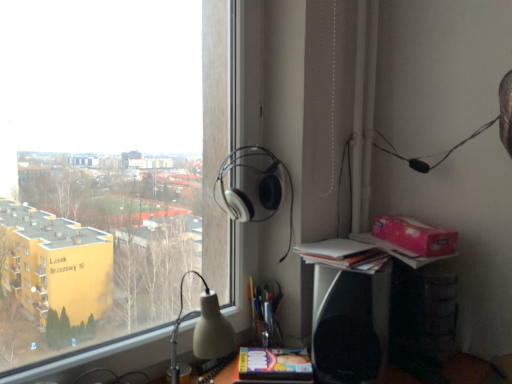
This screenshot has width=512, height=384. Identify the location of transparent glass window at upper left. (111, 170).

Find the location of `pink cardboard box at upper right`. pink cardboard box at upper right is located at coordinates (415, 235).

Considering the sizes of objects white paper stack at right and matte yellow paperback book at lower center in the image provided, who is thinner, white paper stack at right or matte yellow paperback book at lower center?

matte yellow paperback book at lower center.

Between white paper stack at right and matte yellow paperback book at lower center, which one has less height?

matte yellow paperback book at lower center is shorter.

Based on the photo, does white paper stack at right come in front of matte yellow paperback book at lower center?

Yes, the depth of white paper stack at right is less than that of matte yellow paperback book at lower center.

From the image's perspective, is white paper stack at right located beneath matte yellow paperback book at lower center?

Incorrect, from the image's perspective, white paper stack at right is higher than matte yellow paperback book at lower center.

Is matte yellow paperback book at lower center aimed at transparent glass window at upper left?

No.

Image resolution: width=512 pixels, height=384 pixels. Find the location of `paperback book on the right of transparent glass window at upper left`. paperback book on the right of transparent glass window at upper left is located at coordinates (274, 364).

From a real-world perspective, who is located higher, matte yellow paperback book at lower center or transparent glass window at upper left?

In real-world perspective, transparent glass window at upper left is above.

Considering the relative positions of matte yellow paperback book at lower center and transparent glass window at upper left in the image provided, is matte yellow paperback book at lower center to the left or to the right of transparent glass window at upper left?

matte yellow paperback book at lower center is to the right of transparent glass window at upper left.

Is point (355, 374) behind point (337, 249)?

No, (355, 374) is in front of (337, 249).

From the image's perspective, is black plastic speaker at lower right beneath white paper stack at right?

Indeed, from the image's perspective, black plastic speaker at lower right is shown beneath white paper stack at right.

Who is smaller, black plastic speaker at lower right or white paper stack at right?

white paper stack at right is smaller.

Consider the image. Considering the relative positions of black plastic speaker at lower right and white paper stack at right in the image provided, is black plastic speaker at lower right to the left or to the right of white paper stack at right?

black plastic speaker at lower right is positioned on white paper stack at right's right side.

From a real-world perspective, is white paper stack at right above or below pink cardboard box at upper right?

white paper stack at right is below pink cardboard box at upper right.

From the image's perspective, relative to pink cardboard box at upper right, is white paper stack at right above or below?

white paper stack at right is below pink cardboard box at upper right.

Who is shorter, white paper stack at right or pink cardboard box at upper right?

With less height is white paper stack at right.

Does transparent glass window at upper left have a lesser height compared to white paper stack at right?

No, transparent glass window at upper left is not shorter than white paper stack at right.

Does transparent glass window at upper left appear on the right side of white paper stack at right?

No, transparent glass window at upper left is not to the right of white paper stack at right.

The width and height of the screenshot is (512, 384). Find the location of `book beneath the transparent glass window at upper left (from a real-world perspective)`. book beneath the transparent glass window at upper left (from a real-world perspective) is located at coordinates (343, 254).

From the image's perspective, is transparent glass window at upper left on white paper stack at right?

Indeed, from the image's perspective, transparent glass window at upper left is shown above white paper stack at right.

From the image's perspective, which one is positioned higher, white matte headphones at upper center or matte yellow paperback book at lower center?

From the image's view, white matte headphones at upper center is above.

Is white matte headphones at upper center next to matte yellow paperback book at lower center and touching it?

No, white matte headphones at upper center is not beside matte yellow paperback book at lower center.

Is white matte headphones at upper center taller than matte yellow paperback book at lower center?

Indeed, white matte headphones at upper center has a greater height compared to matte yellow paperback book at lower center.

Is white matte headphones at upper center at the left side of matte yellow paperback book at lower center?

Correct, you'll find white matte headphones at upper center to the left of matte yellow paperback book at lower center.

From the image's perspective, between pink cardboard box at upper right and transparent glass window at upper left, who is located below?

pink cardboard box at upper right, from the image's perspective.

In order to click on cardboard box below the transparent glass window at upper left (from the image's perspective) in this screenshot , I will do `click(415, 235)`.

Considering the positions of objects pink cardboard box at upper right and transparent glass window at upper left in the image provided, who is behind, pink cardboard box at upper right or transparent glass window at upper left?

pink cardboard box at upper right is further from the camera.

Does pink cardboard box at upper right have a smaller size compared to transparent glass window at upper left?

Yes, pink cardboard box at upper right is smaller than transparent glass window at upper left.

At what (x,y) coordinates should I click in order to perform the action: click on paperback book on the left side of white paper stack at right. Please return your answer as a coordinate pair (x, y). The image size is (512, 384). Looking at the image, I should click on (274, 364).

Where is `window above the matte yellow paperback book at lower center (from a real-world perspective)`? The height and width of the screenshot is (384, 512). window above the matte yellow paperback book at lower center (from a real-world perspective) is located at coordinates (111, 170).

In the scene shown: Based on their spatial positions, is white matte headphones at upper center or matte yellow paperback book at lower center further from pink cardboard box at upper right?

matte yellow paperback book at lower center.

Considering their positions, is white paper stack at right positioned closer to black plastic speaker at lower right than white matte headphones at upper center?

Based on the image, white paper stack at right appears to be nearer to black plastic speaker at lower right.

From the image, which object appears to be nearer to transparent glass window at upper left, pink cardboard box at upper right or black plastic speaker at lower right?

black plastic speaker at lower right is closer to transparent glass window at upper left.

Based on their spatial positions, is matte yellow paperback book at lower center or white matte headphones at upper center further from black plastic speaker at lower right?

Based on the image, white matte headphones at upper center appears to be further to black plastic speaker at lower right.

Consider the image. Based on their spatial positions, is pink cardboard box at upper right or white matte headphones at upper center closer to matte yellow paperback book at lower center?

Among the two, white matte headphones at upper center is located nearer to matte yellow paperback book at lower center.

Based on their spatial positions, is matte yellow paperback book at lower center or white paper stack at right closer to white matte headphones at upper center?

white paper stack at right is positioned closer to the anchor white matte headphones at upper center.

Estimate the real-world distances between objects in this image. Which object is closer to black plastic speaker at lower right, white matte headphones at upper center or transparent glass window at upper left?

white matte headphones at upper center is positioned closer to the anchor black plastic speaker at lower right.

Looking at the image, which one is located closer to matte yellow paperback book at lower center, transparent glass window at upper left or pink cardboard box at upper right?

Based on the image, pink cardboard box at upper right appears to be nearer to matte yellow paperback book at lower center.

Locate an element on the screen. The width and height of the screenshot is (512, 384). paperback book situated between white matte headphones at upper center and pink cardboard box at upper right from left to right is located at coordinates (274, 364).

I want to click on computer desk between transparent glass window at upper left and matte yellow paperback book at lower center from top to bottom, so click(x=354, y=303).

Identify the location of computer desk between matte yellow paperback book at lower center and pink cardboard box at upper right in the horizontal direction. (354, 303).

Find the location of `paperback book between transparent glass window at upper left and pink cardboard box at upper right in the horizontal direction`. paperback book between transparent glass window at upper left and pink cardboard box at upper right in the horizontal direction is located at coordinates (274, 364).